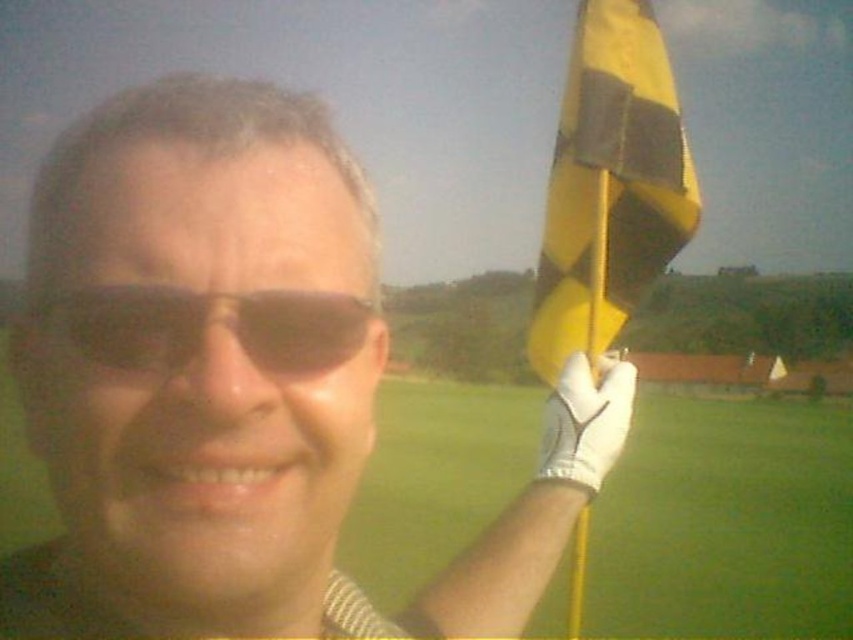
Can you confirm if yellow fabric flag at right is positioned to the left of yellow/black striped flag at upper right?

No, yellow fabric flag at right is not to the left of yellow/black striped flag at upper right.

What do you see at coordinates (724, 522) in the screenshot?
I see `yellow fabric flag at right` at bounding box center [724, 522].

Where is `yellow fabric flag at right`? This screenshot has height=640, width=853. yellow fabric flag at right is located at coordinates (724, 522).

Is white textured glove at upper right further to camera compared to yellow/black striped flag at upper right?

That is False.

Is white textured glove at upper right above yellow/black striped flag at upper right?

Actually, white textured glove at upper right is below yellow/black striped flag at upper right.

Between point (90, 596) and point (640, 67), which one is positioned behind?

The point (640, 67) is behind.

Find the location of a particular element. white textured glove at upper right is located at coordinates (221, 381).

Who is lower down, white textured glove at upper right or white textured glove at right?

white textured glove at right is below.

Can you confirm if white textured glove at upper right is positioned above white textured glove at right?

Yes.

At what (x,y) coordinates should I click in order to perform the action: click on white textured glove at upper right. Please return your answer as a coordinate pair (x, y). This screenshot has width=853, height=640. Looking at the image, I should click on (221, 381).